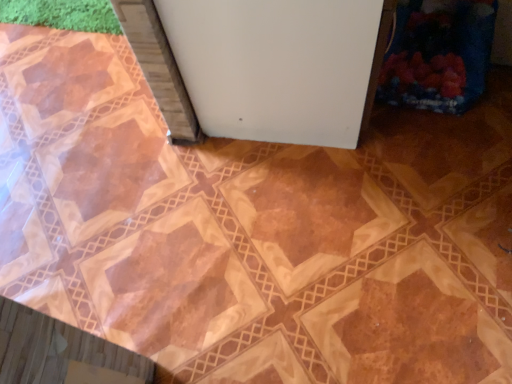
The image size is (512, 384). Describe the element at coordinates (279, 66) in the screenshot. I see `white matte screen door at center` at that location.

Image resolution: width=512 pixels, height=384 pixels. Find the location of `white matte screen door at center`. white matte screen door at center is located at coordinates (279, 66).

What is the approximate width of white matte screen door at center?

21.74 inches.

Where is `white matte screen door at center`? white matte screen door at center is located at coordinates (279, 66).